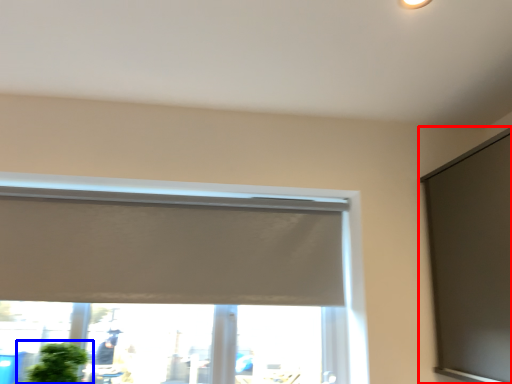
Question: Which object appears farthest to the camera in this image, window screen (highlighted by a red box) or houseplant (highlighted by a blue box)?

Choices:
 (A) window screen
 (B) houseplant

Answer: (B)